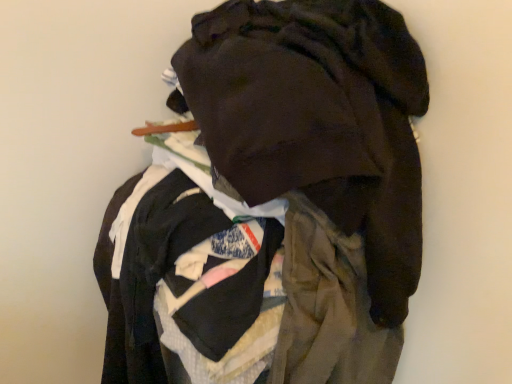
Question: Should I look upward or downward to see dark matte jacket at center?

Choices:
 (A) down
 (B) up

Answer: (A)